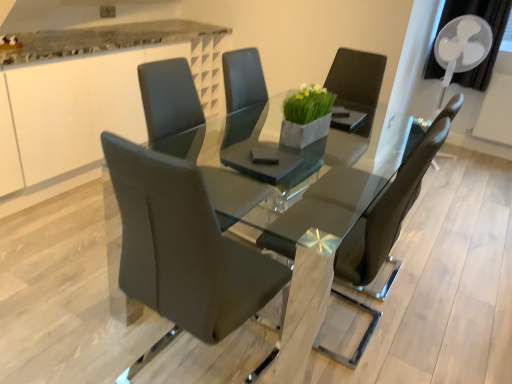
Question: Is high-gloss black table at center taller or shorter than white glossy counter at upper left?

Choices:
 (A) tall
 (B) short

Answer: (B)

Question: Considering the relative positions of high-gloss black table at center and white glossy counter at upper left in the image provided, is high-gloss black table at center to the left or to the right of white glossy counter at upper left?

Choices:
 (A) right
 (B) left

Answer: (A)

Question: Which object is positioned farthest from the white plastic mechanical fan at upper right?

Choices:
 (A) white glossy counter at upper left
 (B) matte black chair at center, which is counted as the first chair, starting from the front
 (C) high-gloss black table at center
 (D) matte black chair at center, which is counted as the 2th chair, starting from the back
 (E) matte black chair at center, placed as the first chair when sorted from back to front

Answer: (B)

Question: Considering the real-world distances, which object is farthest from the white glossy counter at upper left?

Choices:
 (A) white plastic mechanical fan at upper right
 (B) matte black chair at center, positioned as the third chair in front-to-back order
 (C) matte black chair at center, which is counted as the 2th chair, starting from the back
 (D) high-gloss black table at center
 (E) matte black chair at center, the third chair viewed from the back

Answer: (A)